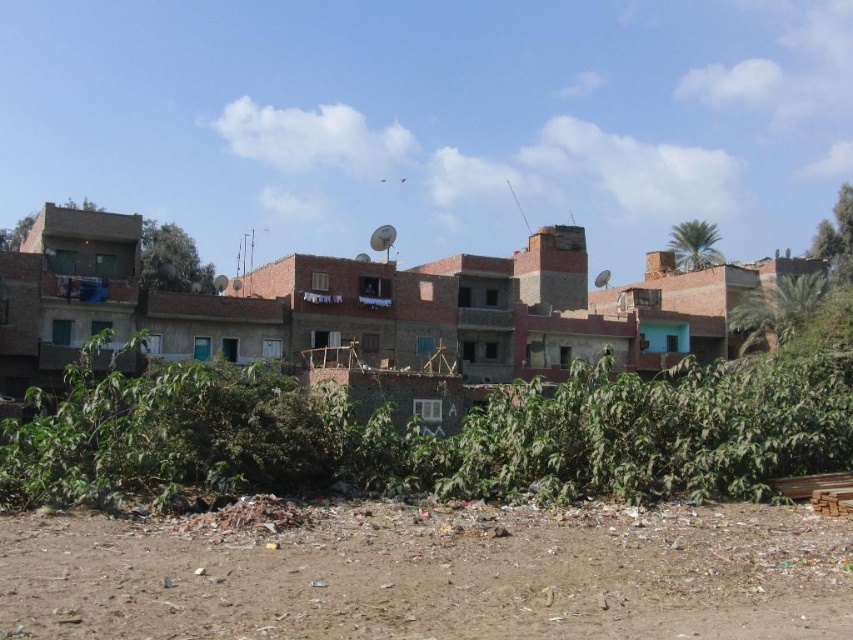
Question: Is brown dirt field at lower center above green leafy plants at center?

Choices:
 (A) yes
 (B) no

Answer: (B)

Question: Which object appears farthest from the camera in this image?

Choices:
 (A) brown dirt field at lower center
 (B) green leafy plants at center

Answer: (B)

Question: Does brown dirt field at lower center have a lesser width compared to green leafy plants at center?

Choices:
 (A) no
 (B) yes

Answer: (B)

Question: Is brown dirt field at lower center bigger than green leafy plants at center?

Choices:
 (A) no
 (B) yes

Answer: (A)

Question: Which point appears farthest from the camera in this image?

Choices:
 (A) (x=674, y=387)
 (B) (x=57, y=602)

Answer: (A)